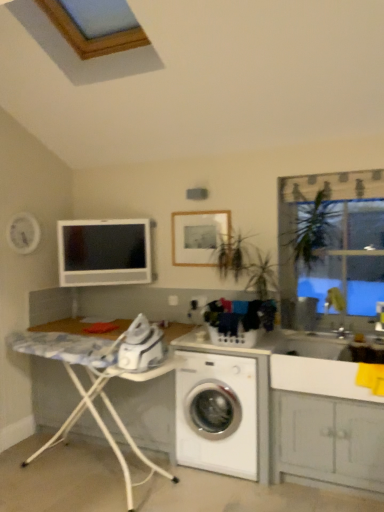
You are a GUI agent. You are given a task and a screenshot of the screen. Output one action in this format:
    pyautogui.click(x=<x>, y=<y>)
    Task: Click on the vacant space underneath white marble ironing board at lower left (from a real-world perspective)
    
    Given the screenshot: What is the action you would take?
    pyautogui.click(x=92, y=473)